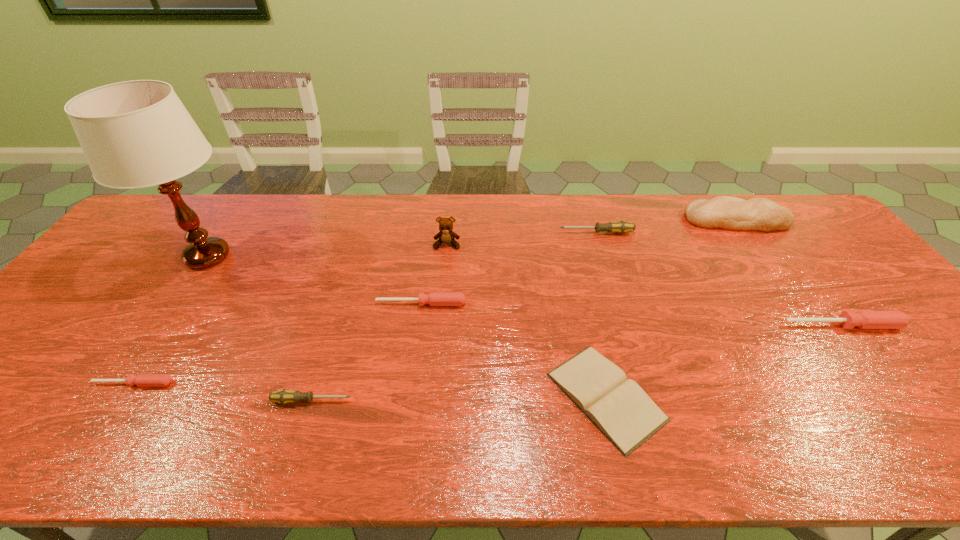
Find the location of `vacant area in the image that satisfies the following two spatial constraints: 1. on the front-facing side of the brown teddy bear; 2. at the tip of the seventh object from right to left`. vacant area in the image that satisfies the following two spatial constraints: 1. on the front-facing side of the brown teddy bear; 2. at the tip of the seventh object from right to left is located at coordinates (434, 401).